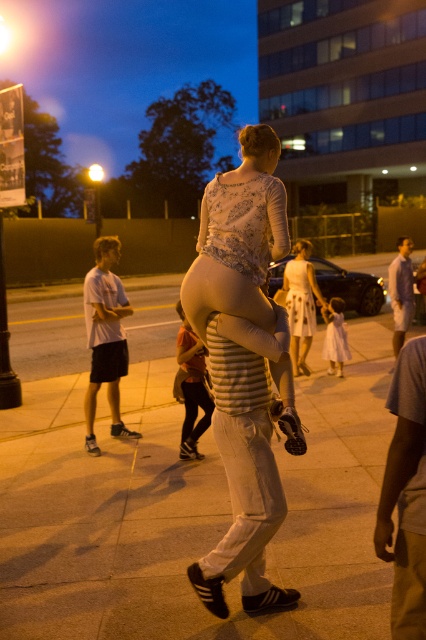
Which is more to the left, white cotton t-shirt at left or white lace dress at center?

white cotton t-shirt at left is more to the left.

Locate an element on the screen. Image resolution: width=426 pixels, height=640 pixels. white cotton t-shirt at left is located at coordinates (104, 337).

Between white cotton t-shirt at left and light purple striped shirt at center, which one appears on the left side from the viewer's perspective?

Positioned to the left is white cotton t-shirt at left.

Does point (89, 307) come behind point (400, 305)?

That is False.

Identify the location of white cotton t-shirt at left. This screenshot has width=426, height=640. (104, 337).

Does light beige fabric at center appear over white lace dress at center?

Yes.

Can you confirm if light beige fabric at center is positioned to the right of white lace dress at center?

No, light beige fabric at center is not to the right of white lace dress at center.

Find the location of a particular element. The image size is (426, 640). light beige fabric at center is located at coordinates (213, 288).

At what (x,y) coordinates should I click in order to perform the action: click on light beige fabric at center. Please return your answer as a coordinate pair (x, y). This screenshot has width=426, height=640. Looking at the image, I should click on (213, 288).